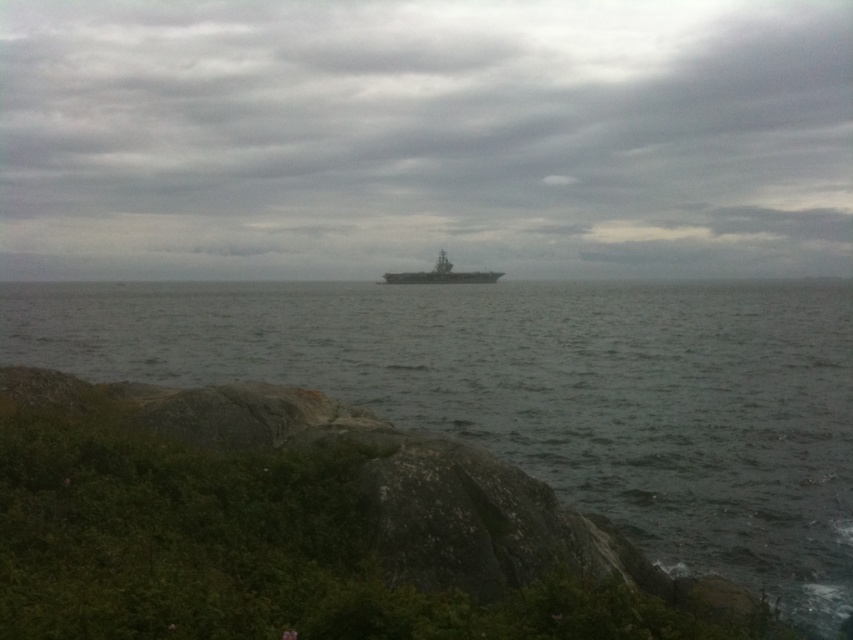
Between point (844, 518) and point (474, 269), which one is positioned in front?

Point (844, 518) is in front.

Measure the distance between gray matte water at center and camera.

They are 51.43 feet apart.

I want to click on gray matte water at center, so click(543, 392).